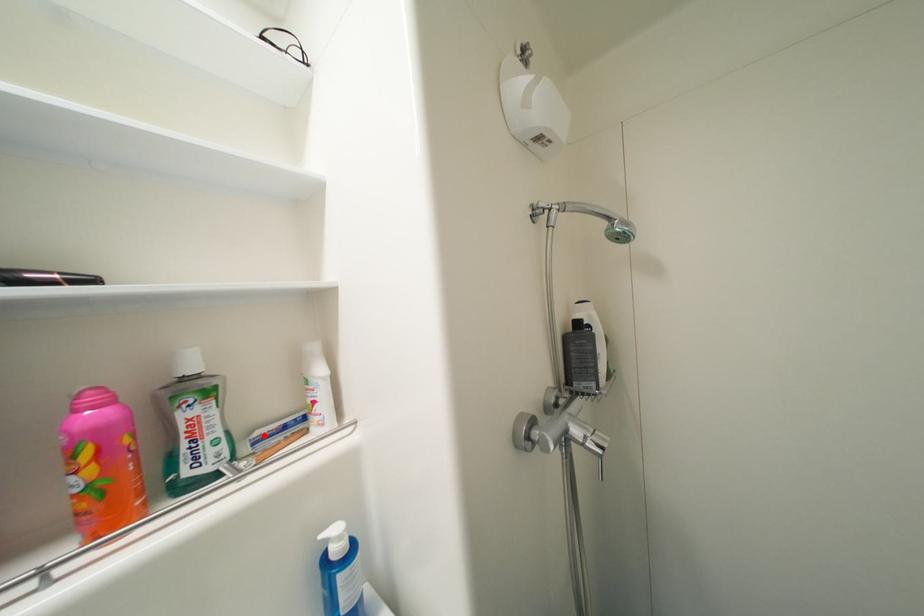
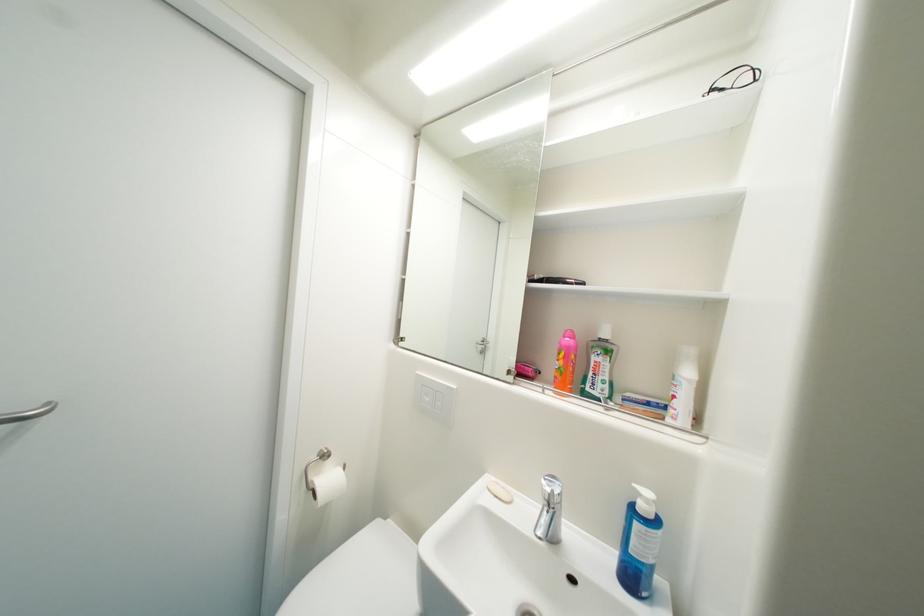
In the second image, find the point that corresponds to the highlighted location in the first image.

(635, 397)